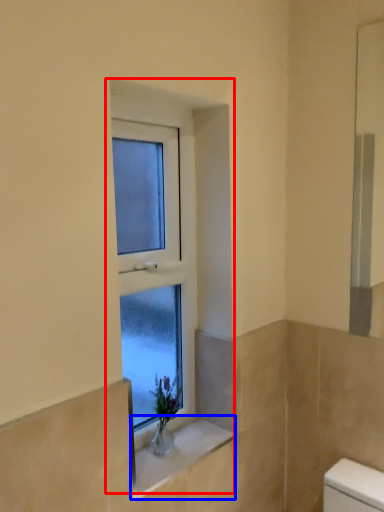
Question: Which object is closer to the camera taking this photo, window (highlighted by a red box) or window sill (highlighted by a blue box)?

Choices:
 (A) window
 (B) window sill

Answer: (A)